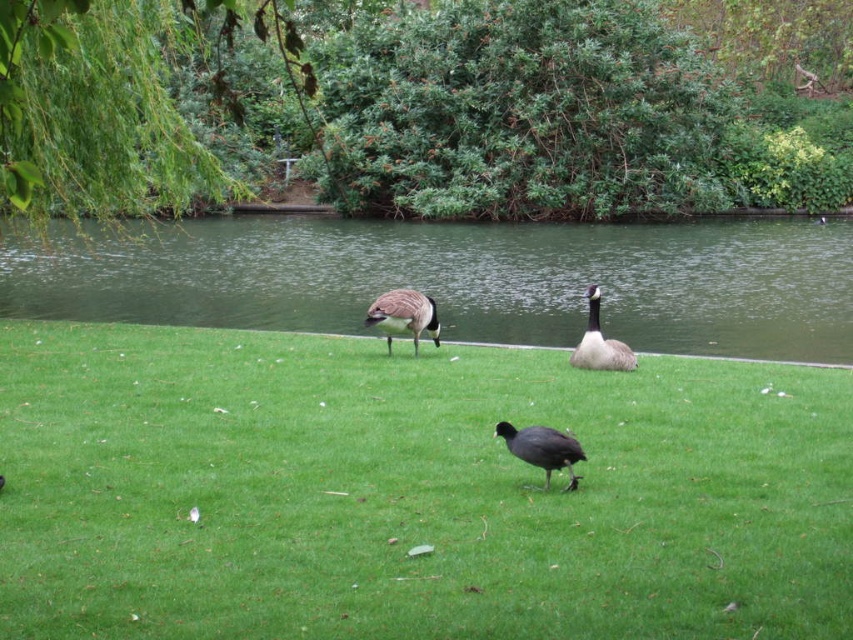
Question: Is black matte bird at center thinner than white downy goose at center?

Choices:
 (A) yes
 (B) no

Answer: (A)

Question: Which point appears farthest from the camera in this image?

Choices:
 (A) (337, 278)
 (B) (376, 314)
 (C) (590, 358)
 (D) (136, 474)

Answer: (A)

Question: Which point appears farthest from the camera in this image?

Choices:
 (A) (810, 483)
 (B) (590, 307)
 (C) (538, 246)
 (D) (544, 456)

Answer: (C)

Question: Which point is farther to the camera?

Choices:
 (A) (368, 323)
 (B) (425, 266)
 (C) (560, 435)
 (D) (158, 371)

Answer: (B)

Question: Where is green grass at center located in relation to black matte bird at center in the image?

Choices:
 (A) left
 (B) right

Answer: (A)

Question: Observing the image, what is the correct spatial positioning of green grass at center in reference to black matte bird at center?

Choices:
 (A) left
 (B) right

Answer: (A)